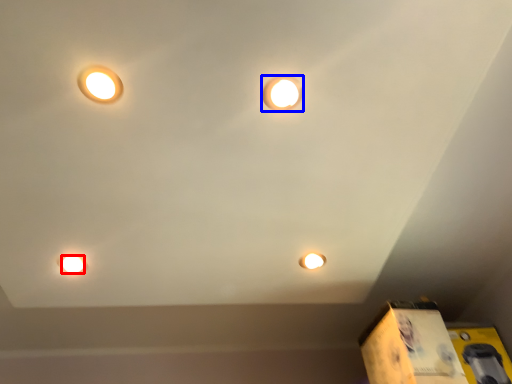
Question: Among these objects, which one is farthest to the camera, light bulb (highlighted by a red box) or lamp (highlighted by a blue box)?

Choices:
 (A) light bulb
 (B) lamp

Answer: (A)